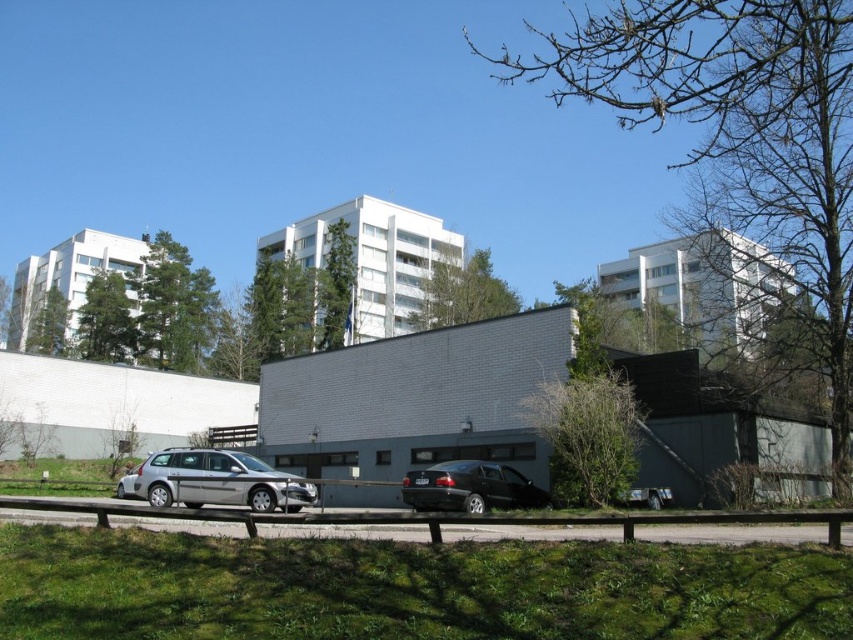
You are a pedestrian standing on the grassy area behind the wooden railing. You want to cross to the other side of the paved road where there are shops. The silver metallic station wagon at center and the black glossy car at center are parked in your path. Which car should you move around to reach the shops safely?

You should move around the silver metallic station wagon at center because it is positioned to the left of the black glossy car at center, so going around it would allow you to navigate past both vehicles and reach the shops safely.

Based on the photo, you are standing in the urban landscape and want to determine the relative positions of two points marked in the scene. Which point is closer to you, point 1 at coordinates (202, 472) or point 2 at coordinates (537, 497)?

Point 1 at coordinates (202, 472) is closer to the viewer than point 2 at coordinates (537, 497).